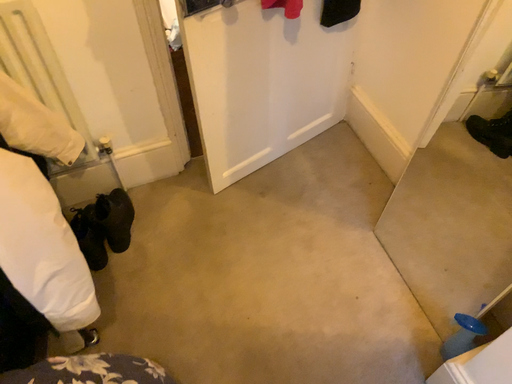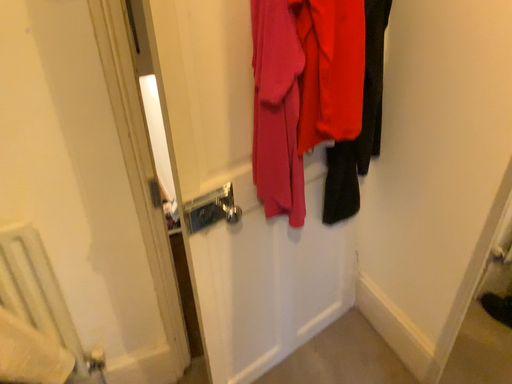
Question: How did the camera likely rotate when shooting the video?

Choices:
 (A) rotated upward
 (B) rotated downward

Answer: (A)